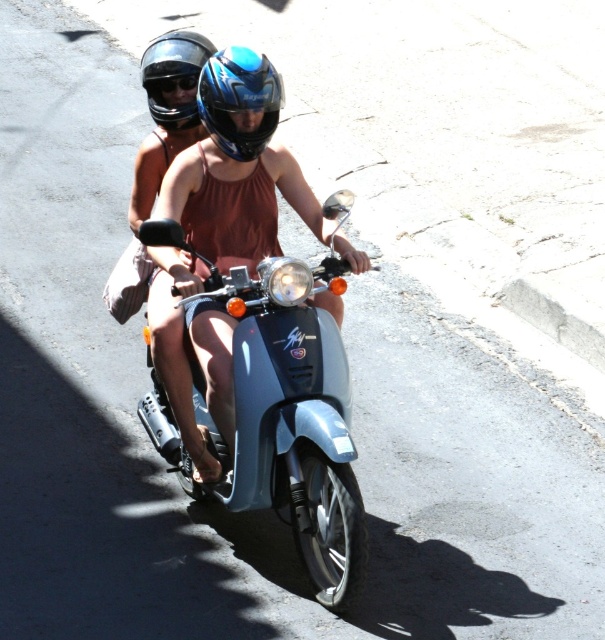
Who is positioned more to the left, matte black helmet at upper center or black matte goggles at upper center?

black matte goggles at upper center is more to the left.

Who is shorter, matte black helmet at upper center or black matte goggles at upper center?

With less height is black matte goggles at upper center.

At what (x,y) coordinates should I click in order to perform the action: click on matte black helmet at upper center. Please return your answer as a coordinate pair (x, y). Image resolution: width=605 pixels, height=640 pixels. Looking at the image, I should click on (172, 72).

Does point (270, 339) come closer to viewer compared to point (162, 67)?

Yes, it is in front of point (162, 67).

Can you confirm if metallic blue scooter at center is smaller than matte black helmet at upper center?

Actually, metallic blue scooter at center might be larger than matte black helmet at upper center.

Does point (341, 602) come farther from viewer compared to point (172, 106)?

No, (341, 602) is in front of (172, 106).

The height and width of the screenshot is (640, 605). What are the coordinates of `metallic blue scooter at center` in the screenshot? It's located at (281, 413).

Who is more forward, (336,547) or (183,90)?

Point (336,547)

Does metallic blue scooter at center appear under black matte goggles at upper center?

Indeed, metallic blue scooter at center is positioned under black matte goggles at upper center.

Between point (234, 474) and point (177, 90), which one is positioned behind?

Point (177, 90)

Locate an element on the screen. metallic blue scooter at center is located at coordinates (281, 413).